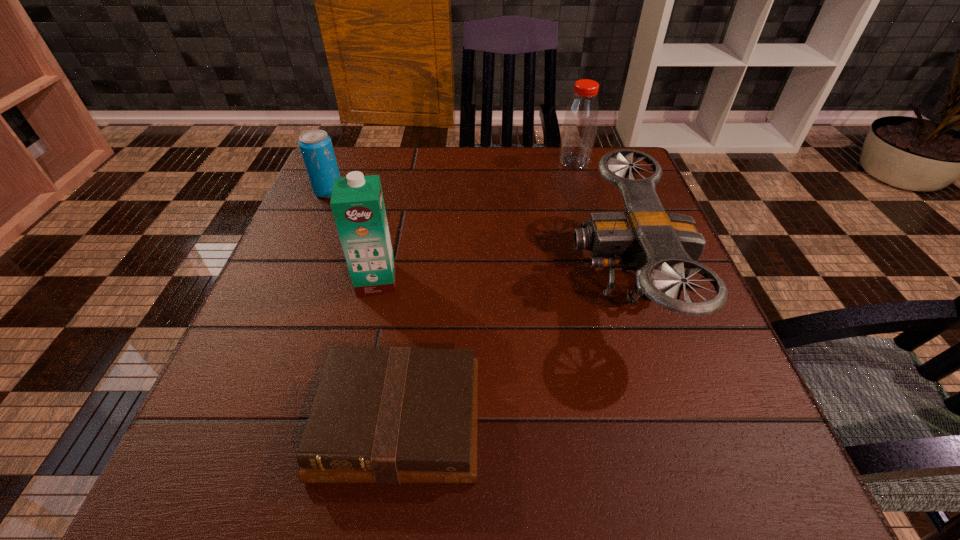
This screenshot has width=960, height=540. What are the coordinates of `vacant area between the bottle and the carton` in the screenshot? It's located at (475, 221).

Locate an element on the screen. The height and width of the screenshot is (540, 960). vacant area between the third shortest object and the carton is located at coordinates (500, 279).

Locate an element on the screen. vacant region between the third shortest object and the Bible is located at coordinates point(511,350).

You are a GUI agent. You are given a task and a screenshot of the screen. Output one action in this format:
    pyautogui.click(x=<x>, y=<y>)
    Task: Click on the second closest object to the farthest object
    The width and height of the screenshot is (960, 540).
    Given the screenshot: What is the action you would take?
    pyautogui.click(x=357, y=203)

Point out which object is positioned as the second nearest to the carton. Please provide its 2D coordinates. Your answer should be formatted as a tuple, i.e. [(x, y)], where the tuple contains the x and y coordinates of a point satisfying the conditions above.

[(316, 147)]

Locate an element on the screen. This screenshot has width=960, height=540. blank space that satisfies the following two spatial constraints: 1. on the front-facing side of the third tallest object; 2. on the spine side of the shortest object is located at coordinates 669,421.

The height and width of the screenshot is (540, 960). I want to click on vacant point that satisfies the following two spatial constraints: 1. on the front-facing side of the third tallest object; 2. on the spine side of the shortest object, so click(x=669, y=421).